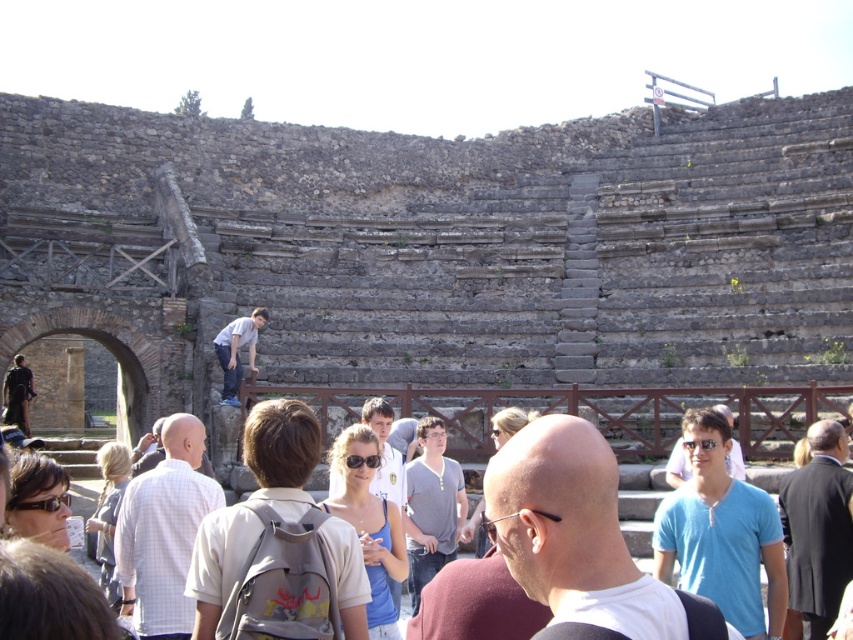
Consider the image. You are standing at the entrance of the amphitheater and want to take a photo of the matte blue tank top at center and the light brown hair at lower left. Which object should you focus on first to ensure both are in the frame?

You should focus on the matte blue tank top at center first since it is closer to the viewer than the light brown hair at lower left, allowing both to be in the frame by adjusting the camera angle accordingly.

You are standing at the entrance of the ancient amphitheater and see a person wearing a black suit jacket at center and a gray backpack at center. Which item is closer to you?

The black suit jacket at center is closer to you because it is further to the viewer than the gray backpack at center.

You are a tour guide leading a group at the ancient amphitheater. You notice two visitors wearing a black suit jacket at center and a matte blue tank top at center. Which visitor is standing to the right of the other?

The black suit jacket at center is positioned on the right side of matte blue tank top at center, so the visitor wearing the black suit jacket at center is standing to the right of the one in the matte blue tank top at center.